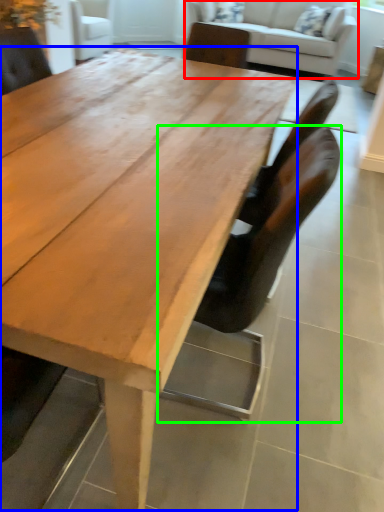
Question: Which object is positioned farthest from studio couch (highlighted by a red box)? Select from coffee table (highlighted by a blue box) and chair (highlighted by a green box).

Choices:
 (A) coffee table
 (B) chair

Answer: (B)